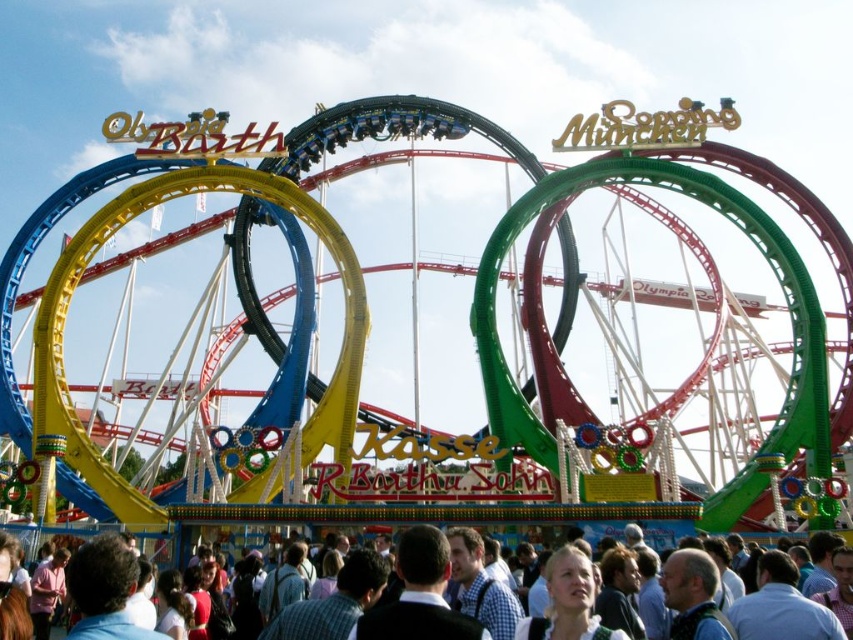
Question: Is metallic roller coaster at center thinner than matte white crowd at lower center?

Choices:
 (A) no
 (B) yes

Answer: (A)

Question: Is metallic roller coaster at center behind matte white crowd at lower center?

Choices:
 (A) yes
 (B) no

Answer: (A)

Question: Which point is farther from the camera taking this photo?

Choices:
 (A) (38, 534)
 (B) (637, 150)

Answer: (B)

Question: Which point is farther to the camera?

Choices:
 (A) (54, 634)
 (B) (267, 166)

Answer: (B)

Question: Is metallic roller coaster at center above matte white crowd at lower center?

Choices:
 (A) yes
 (B) no

Answer: (A)